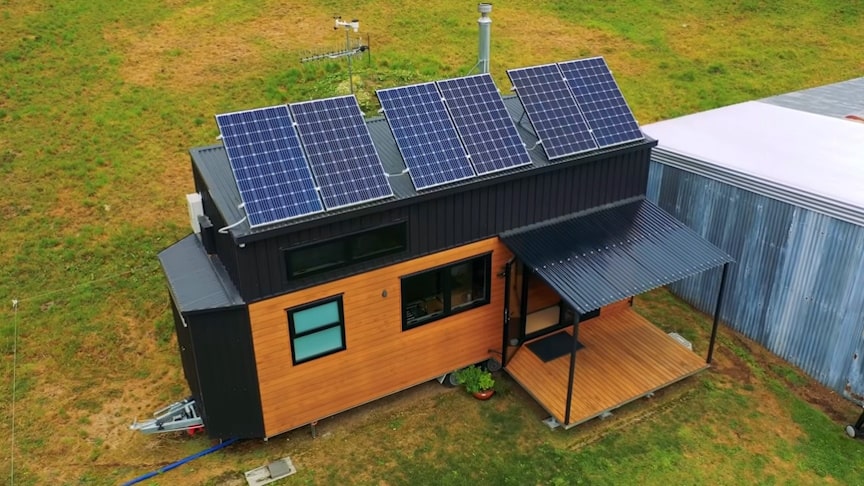
Where is `toy`? toy is located at coordinates coord(486,386).